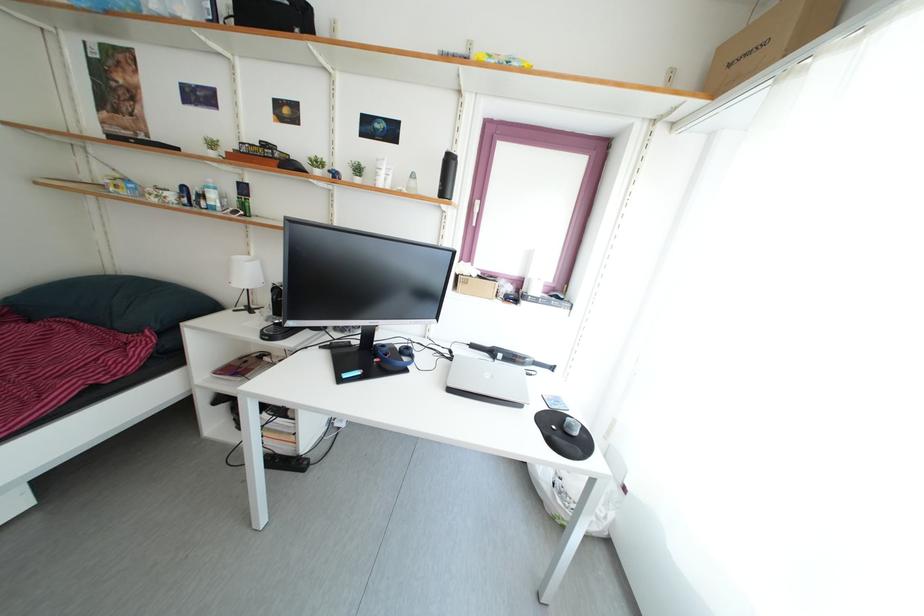
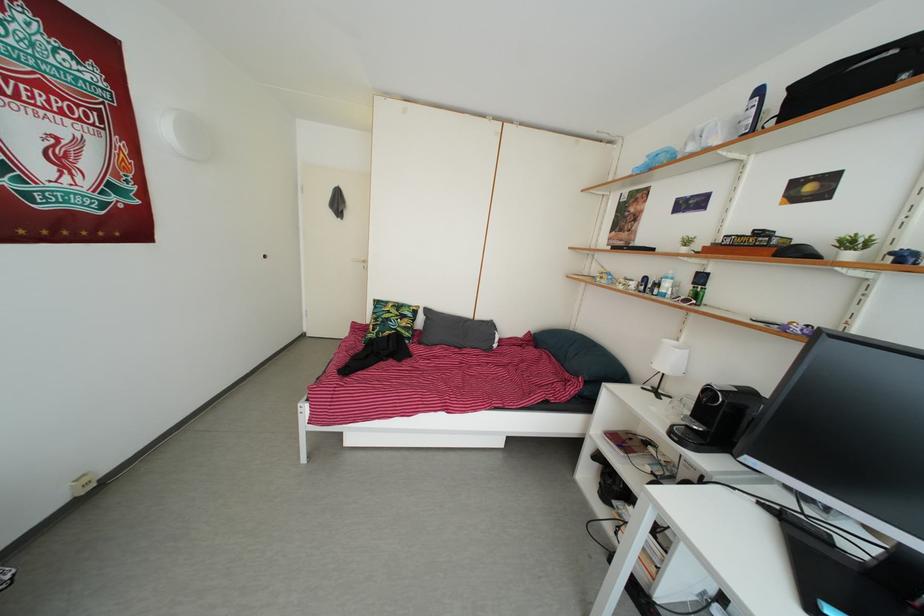
Locate, in the second image, the point that corresponds to the point at 116,282 in the first image.

(578, 338)